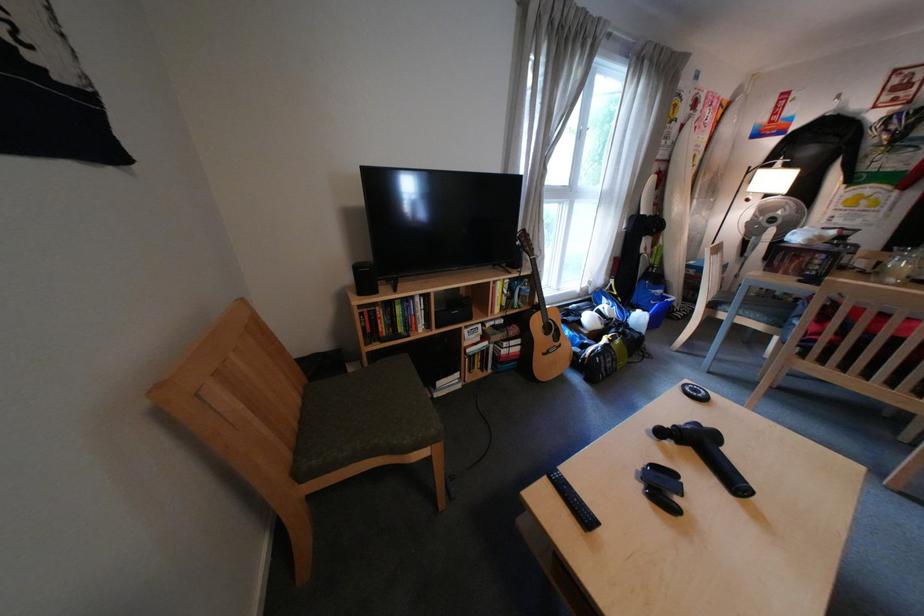
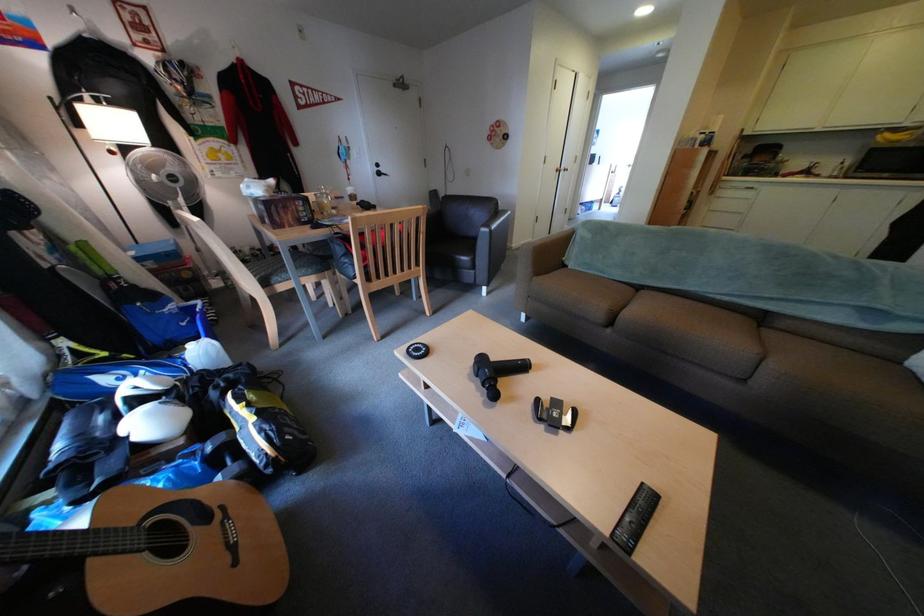
Locate, in the second image, the point that corresponds to (x=779, y=321) in the first image.

(324, 272)